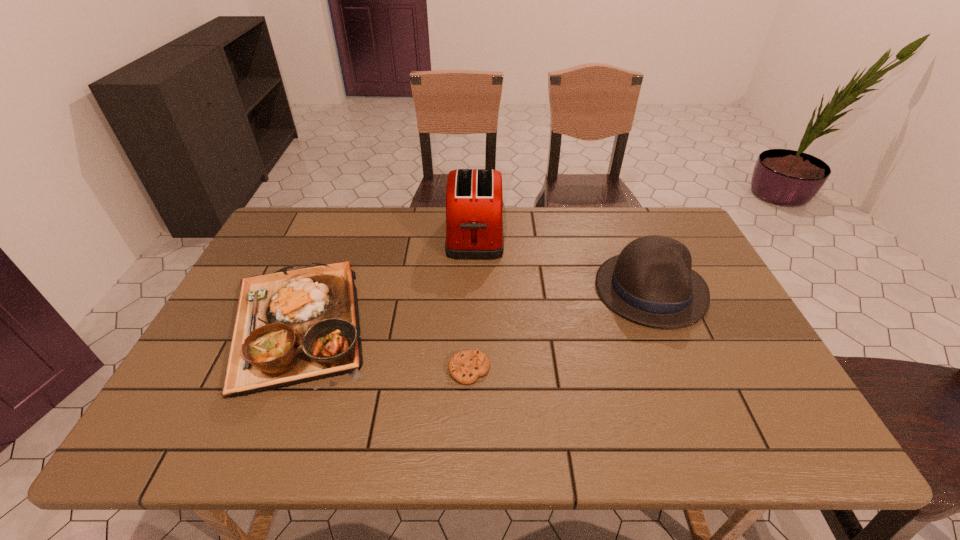
Identify the location of vacant region that satisfies the following two spatial constraints: 1. on the back side of the toaster; 2. on the right side of the shortest object. (472, 235).